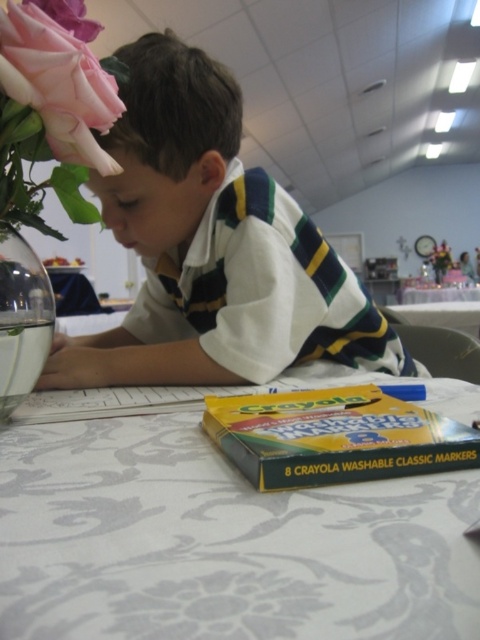
In the scene shown: You are a delivery person who needs to place a small package on the table. The package is 10 inches long. You see the white damask tablecloth at lower center and the clear glass vase at left. Is there enough space between them to place the package horizontally?

The distance between the white damask tablecloth at lower center and the clear glass vase at left is 8.49 inches. Since the package is 10 inches long, it won not fit between them horizontally.